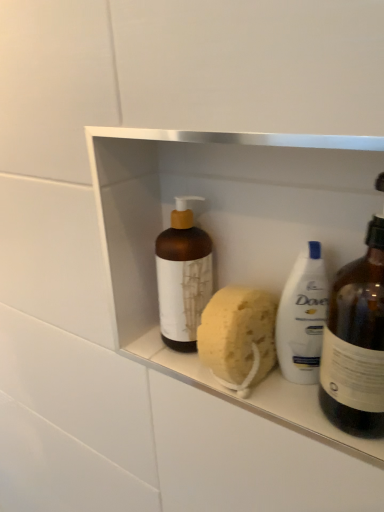
Image resolution: width=384 pixels, height=512 pixels. Describe the element at coordinates (238, 337) in the screenshot. I see `yellow sponge at center` at that location.

Measure the distance between point (380,254) and camera.

Point (380,254) is 44.40 centimeters from camera.

The image size is (384, 512). Describe the element at coordinates (356, 342) in the screenshot. I see `matte brown bottle at right, marked as the first bottle in a right-to-left arrangement` at that location.

What are the coordinates of `brown matte bottle at center, which is the second bottle from right to left` in the screenshot? It's located at (183, 276).

Is matte brown bottle at right, which ranks as the second bottle in left-to-right order, outside of yellow sponge at center?

Yes, matte brown bottle at right, which ranks as the second bottle in left-to-right order, is located beyond the bounds of yellow sponge at center.

Locate an element on the screen. bottle that is the 2nd object above the yellow sponge at center (from a real-world perspective) is located at coordinates (356, 342).

From a real-world perspective, who is located higher, matte brown bottle at right, which ranks as the second bottle in left-to-right order, or yellow sponge at center?

matte brown bottle at right, which ranks as the second bottle in left-to-right order, is physically above.

Is brown matte bottle at center, the 1th bottle from the left, not within matte brown bottle at right, marked as the first bottle in a right-to-left arrangement?

Absolutely, brown matte bottle at center, the 1th bottle from the left, is external to matte brown bottle at right, marked as the first bottle in a right-to-left arrangement.

Considering the sizes of objects brown matte bottle at center, which is the second bottle from right to left, and matte brown bottle at right, which ranks as the second bottle in left-to-right order, in the image provided, who is thinner, brown matte bottle at center, which is the second bottle from right to left, or matte brown bottle at right, which ranks as the second bottle in left-to-right order,?

brown matte bottle at center, which is the second bottle from right to left.

Does brown matte bottle at center, which is the second bottle from right to left, turn towards matte brown bottle at right, which ranks as the second bottle in left-to-right order?

No, brown matte bottle at center, which is the second bottle from right to left, is not facing towards matte brown bottle at right, which ranks as the second bottle in left-to-right order.

From the picture: Is brown matte bottle at center, the 1th bottle from the left, in front of or behind matte brown bottle at right, marked as the first bottle in a right-to-left arrangement, in the image?

brown matte bottle at center, the 1th bottle from the left, is behind matte brown bottle at right, marked as the first bottle in a right-to-left arrangement.

Would you say yellow sponge at center is to the left or to the right of brown matte bottle at center, the 1th bottle from the left, in the picture?

From the image, it's evident that yellow sponge at center is to the right of brown matte bottle at center, the 1th bottle from the left.

From a real-world perspective, is yellow sponge at center located higher than brown matte bottle at center, the 1th bottle from the left?

Actually, yellow sponge at center is physically below brown matte bottle at center, the 1th bottle from the left, in the real world.

Is yellow sponge at center wider than brown matte bottle at center, the 1th bottle from the left?

Correct, the width of yellow sponge at center exceeds that of brown matte bottle at center, the 1th bottle from the left.

Is there a large distance between yellow sponge at center and brown matte bottle at center, the 1th bottle from the left?

They are positioned close to each other.

I want to click on bottle that is above the matte brown bottle at right, which ranks as the second bottle in left-to-right order (from the image's perspective), so click(x=183, y=276).

In the scene shown: Is brown matte bottle at center, which is the second bottle from right to left, at the back of matte brown bottle at right, which ranks as the second bottle in left-to-right order?

That's not correct — matte brown bottle at right, which ranks as the second bottle in left-to-right order, is not looking away from brown matte bottle at center, which is the second bottle from right to left.

Is point (377, 325) more distant than point (184, 246)?

No, it is in front of (184, 246).

Is yellow sponge at center turned away from matte brown bottle at right, marked as the first bottle in a right-to-left arrangement?

No, yellow sponge at center is not facing the opposite direction of matte brown bottle at right, marked as the first bottle in a right-to-left arrangement.

Is yellow sponge at center beside matte brown bottle at right, marked as the first bottle in a right-to-left arrangement?

No, yellow sponge at center is not with matte brown bottle at right, marked as the first bottle in a right-to-left arrangement.

Between yellow sponge at center and matte brown bottle at right, which ranks as the second bottle in left-to-right order, which one has more height?

matte brown bottle at right, which ranks as the second bottle in left-to-right order.

Is yellow sponge at center outside of matte brown bottle at right, marked as the first bottle in a right-to-left arrangement?

That's correct, yellow sponge at center is outside of matte brown bottle at right, marked as the first bottle in a right-to-left arrangement.

Is brown matte bottle at center, the 1th bottle from the left, next to yellow sponge at center and touching it?

Indeed, brown matte bottle at center, the 1th bottle from the left, and yellow sponge at center are beside each other and touching.

From a real-world perspective, is brown matte bottle at center, the 1th bottle from the left, below yellow sponge at center?

No.

Considering the relative sizes of brown matte bottle at center, the 1th bottle from the left, and yellow sponge at center in the image provided, is brown matte bottle at center, the 1th bottle from the left, shorter than yellow sponge at center?

No.

Find the location of a particular element. The height and width of the screenshot is (512, 384). soap lying below the matte brown bottle at right, marked as the first bottle in a right-to-left arrangement (from the image's perspective) is located at coordinates (238, 337).

Locate an element on the screen. This screenshot has height=512, width=384. bottle behind the matte brown bottle at right, which ranks as the second bottle in left-to-right order is located at coordinates (183, 276).

When comparing their distances from brown matte bottle at center, which is the second bottle from right to left, does matte brown bottle at right, which ranks as the second bottle in left-to-right order, or yellow sponge at center seem further?

matte brown bottle at right, which ranks as the second bottle in left-to-right order, lies further to brown matte bottle at center, which is the second bottle from right to left, than the other object.

When comparing their distances from yellow sponge at center, does matte brown bottle at right, marked as the first bottle in a right-to-left arrangement, or brown matte bottle at center, which is the second bottle from right to left, seem further?

The object further to yellow sponge at center is matte brown bottle at right, marked as the first bottle in a right-to-left arrangement.

Based on the photo, looking at the image, which one is located further to matte brown bottle at right, which ranks as the second bottle in left-to-right order, brown matte bottle at center, the 1th bottle from the left, or yellow sponge at center?

brown matte bottle at center, the 1th bottle from the left, is positioned further to the anchor matte brown bottle at right, which ranks as the second bottle in left-to-right order.

From the image, which object appears to be farther from yellow sponge at center, brown matte bottle at center, the 1th bottle from the left, or matte brown bottle at right, marked as the first bottle in a right-to-left arrangement?

Among the two, matte brown bottle at right, marked as the first bottle in a right-to-left arrangement, is located further to yellow sponge at center.

Looking at the image, which one is located closer to brown matte bottle at center, which is the second bottle from right to left, yellow sponge at center or matte brown bottle at right, which ranks as the second bottle in left-to-right order?

yellow sponge at center lies closer to brown matte bottle at center, which is the second bottle from right to left, than the other object.

When comparing their distances from matte brown bottle at right, marked as the first bottle in a right-to-left arrangement, does yellow sponge at center or brown matte bottle at center, the 1th bottle from the left, seem closer?

Based on the image, yellow sponge at center appears to be nearer to matte brown bottle at right, marked as the first bottle in a right-to-left arrangement.

You are a GUI agent. You are given a task and a screenshot of the screen. Output one action in this format:
    pyautogui.click(x=<x>, y=<y>)
    Task: Click on the soap between brown matte bottle at center, which is the second bottle from right to left, and matte brown bottle at right, which ranks as the second bottle in left-to-right order
    
    Given the screenshot: What is the action you would take?
    pyautogui.click(x=238, y=337)